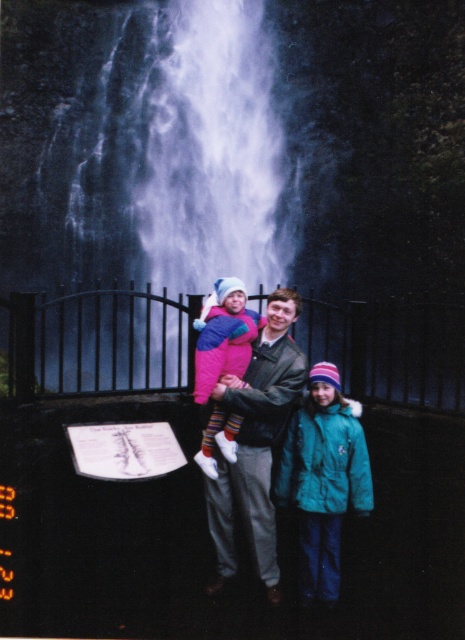
Question: Which point is closer to the camera?

Choices:
 (A) matte pink jacket at center
 (B) black metal fence at center
 (C) teal fleece jacket at lower right

Answer: (C)

Question: Is leather jacket at center wider than matte pink jacket at center?

Choices:
 (A) yes
 (B) no

Answer: (A)

Question: Which of these objects is positioned farthest from the black metal fence at center?

Choices:
 (A) leather jacket at center
 (B) white frothy water at upper center
 (C) matte pink jacket at center

Answer: (C)

Question: Which point is farther to the camera?

Choices:
 (A) leather jacket at center
 (B) black metal fence at center

Answer: (B)

Question: Does teal fleece jacket at lower right have a smaller size compared to matte pink jacket at center?

Choices:
 (A) no
 (B) yes

Answer: (B)

Question: From the image, what is the correct spatial relationship of white frothy water at upper center in relation to matte pink jacket at center?

Choices:
 (A) above
 (B) below

Answer: (A)